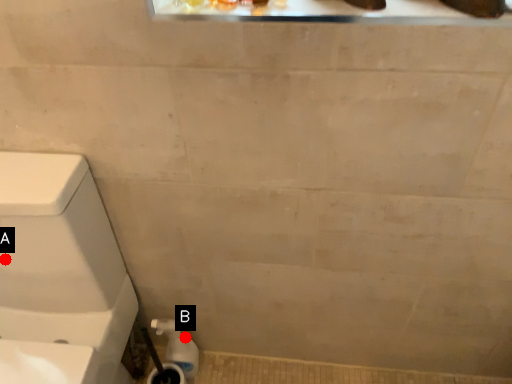
Question: Two points are circled on the image, labeled by A and B beside each circle. Which point appears farthest from the camera in this image?

Choices:
 (A) A is further
 (B) B is further

Answer: (B)